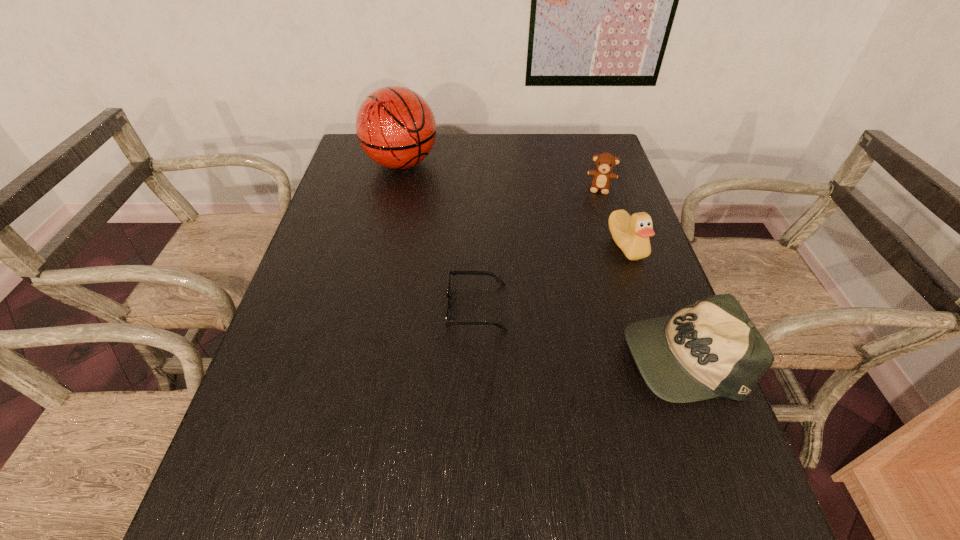
This screenshot has width=960, height=540. In order to click on vacant space on the desktop that is between the fourth object from right to left and the baseball cap and is positioned on the side with spill of the leftmost object in this screenshot , I will do `click(548, 323)`.

I want to click on vacant space on the desktop that is between the shortest object and the baseball cap and is positioned on the face of the teddy bear, so click(x=577, y=330).

Identify the location of vacant space on the desktop that is between the shortest object and the baseball cap and is positioned at the beak of the duck. (576, 330).